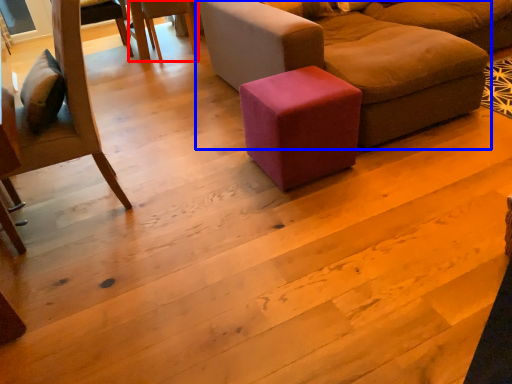
Question: Which point is closer to the camera, chair (highlighted by a red box) or studio couch (highlighted by a blue box)?

Choices:
 (A) chair
 (B) studio couch

Answer: (B)